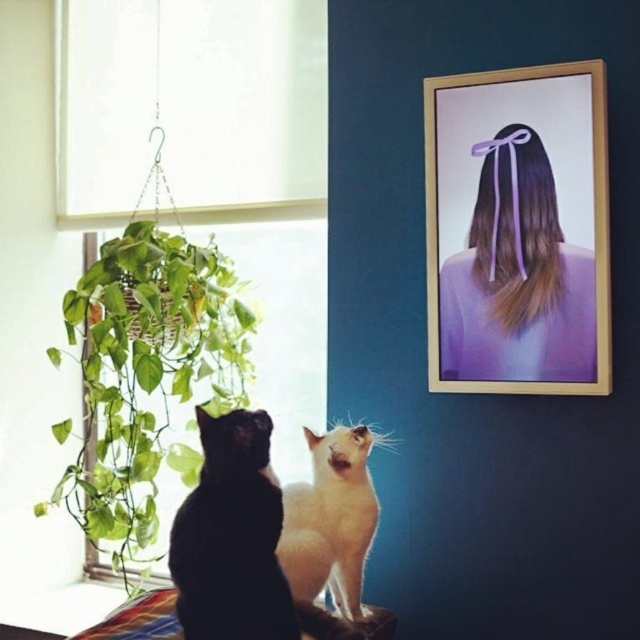
Question: Which of the following is the farthest from the observer?

Choices:
 (A) (86, 276)
 (B) (314, 20)
 (C) (483, 268)

Answer: (B)

Question: Is wooden frame at upper right behind white fabric at upper left?

Choices:
 (A) yes
 (B) no

Answer: (B)

Question: Is black fur cat at lower left positioned in front of white fur cat at center?

Choices:
 (A) no
 (B) yes

Answer: (B)

Question: Considering the real-world distances, which object is farthest from the green leafy plant at left?

Choices:
 (A) black fur cat at lower left
 (B) white fabric at upper left
 (C) wooden frame at upper right

Answer: (C)

Question: Does black fur cat at lower left have a lesser width compared to smooth purple ribbon at upper right?

Choices:
 (A) yes
 (B) no

Answer: (B)

Question: Which object is farther from the camera taking this photo?

Choices:
 (A) black fur cat at lower left
 (B) green leafy plant at left

Answer: (B)